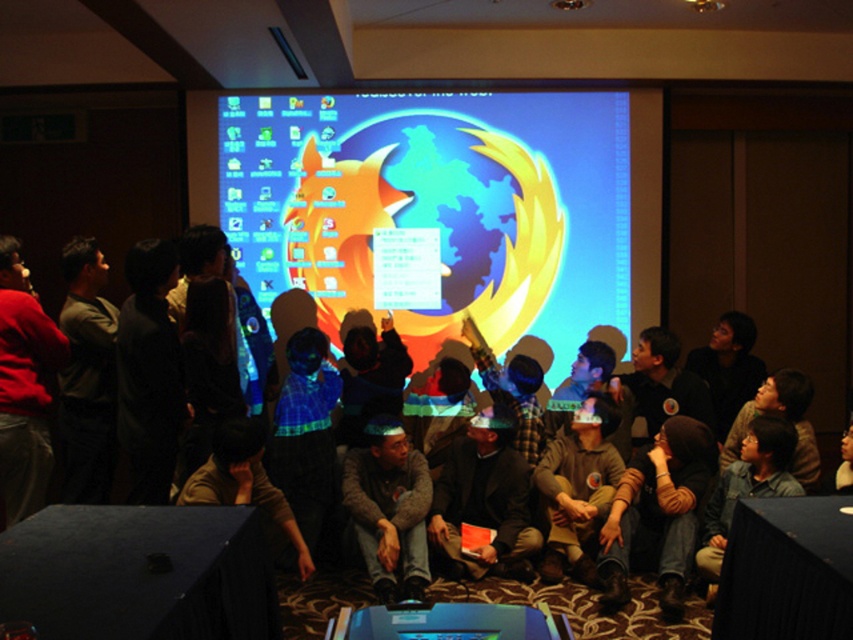
Can you confirm if matte plastic screen at center is wider than dark gray sweater at left?

Yes, matte plastic screen at center is wider than dark gray sweater at left.

Which is more to the left, matte plastic screen at center or dark gray sweater at left?

From the viewer's perspective, dark gray sweater at left appears more on the left side.

Find the location of a particular element. This screenshot has width=853, height=640. matte plastic screen at center is located at coordinates (437, 208).

Can you confirm if matte red sweater at left is smaller than dark brown leather jacket at center?

Correct, matte red sweater at left occupies less space than dark brown leather jacket at center.

Which is more to the right, matte red sweater at left or dark brown leather jacket at center?

Positioned to the right is dark brown leather jacket at center.

Is point (4, 520) positioned in front of point (541, 536)?

Yes, point (4, 520) is closer to viewer.

Where is `matte red sweater at left`? matte red sweater at left is located at coordinates (24, 387).

Consider the image. Is matte plastic screen at center positioned before matte red sweater at left?

That is False.

Which is in front, point (422, 170) or point (50, 417)?

Positioned in front is point (422, 170).

In order to click on matte plastic screen at center in this screenshot , I will do `click(437, 208)`.